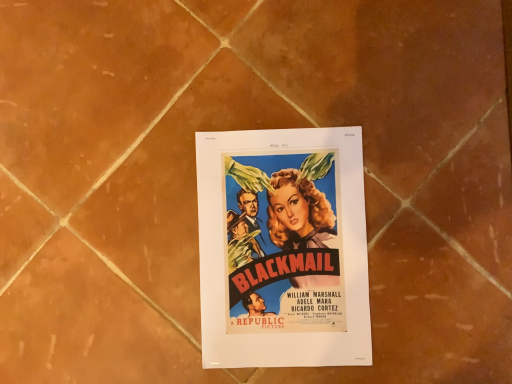
Locate an element on the screen. The width and height of the screenshot is (512, 384). vacant space situated above matte paper poster at center (from a real-world perspective) is located at coordinates (287, 242).